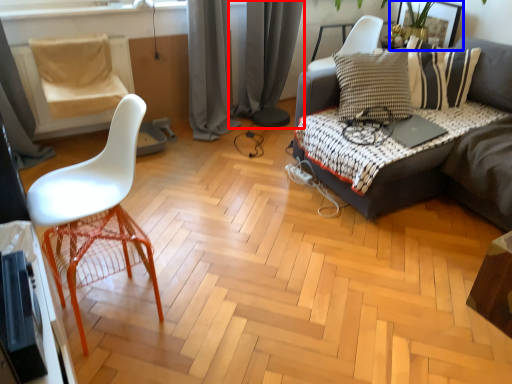
Question: Which point is further to the camera, curtain (highlighted by a red box) or picture frame (highlighted by a blue box)?

Choices:
 (A) curtain
 (B) picture frame

Answer: (B)